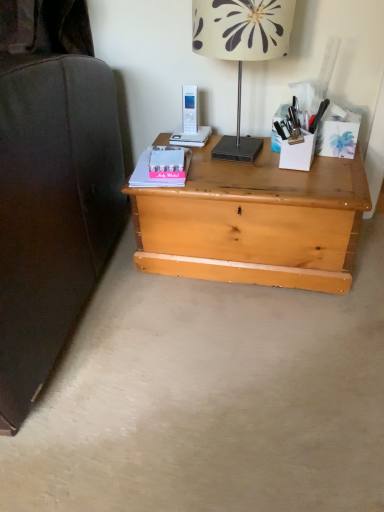
At what (x,y) coordinates should I click in order to perform the action: click on free spot in front of light wood chest at center. Please return your answer as a coordinate pair (x, y). The image size is (384, 512). Looking at the image, I should click on (248, 356).